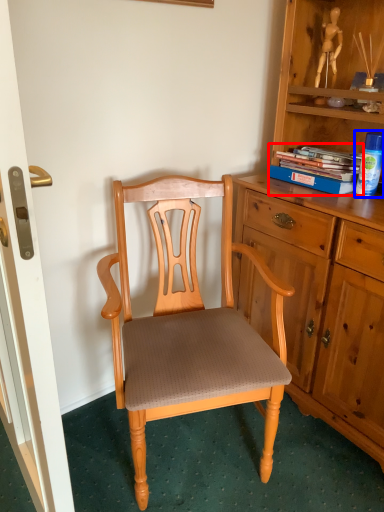
Question: Which of the following is the closest to the observer, book (highlighted by a red box) or toy (highlighted by a blue box)?

Choices:
 (A) book
 (B) toy

Answer: (B)